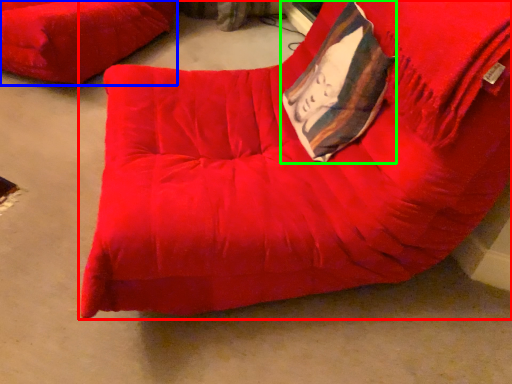
Question: Which is nearer to the furniture (highlighted by a red box)? furniture (highlighted by a blue box) or throw pillow (highlighted by a green box).

Choices:
 (A) furniture
 (B) throw pillow

Answer: (B)